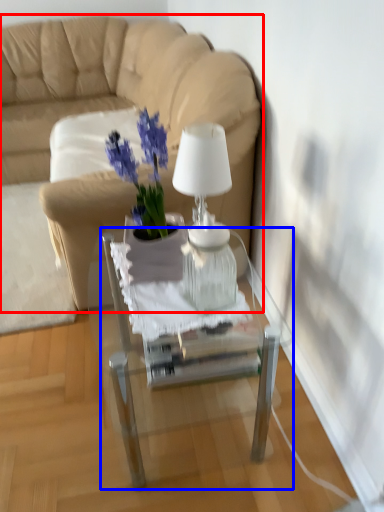
Question: Which point is further to the camera, studio couch (highlighted by a red box) or table (highlighted by a blue box)?

Choices:
 (A) studio couch
 (B) table

Answer: (A)